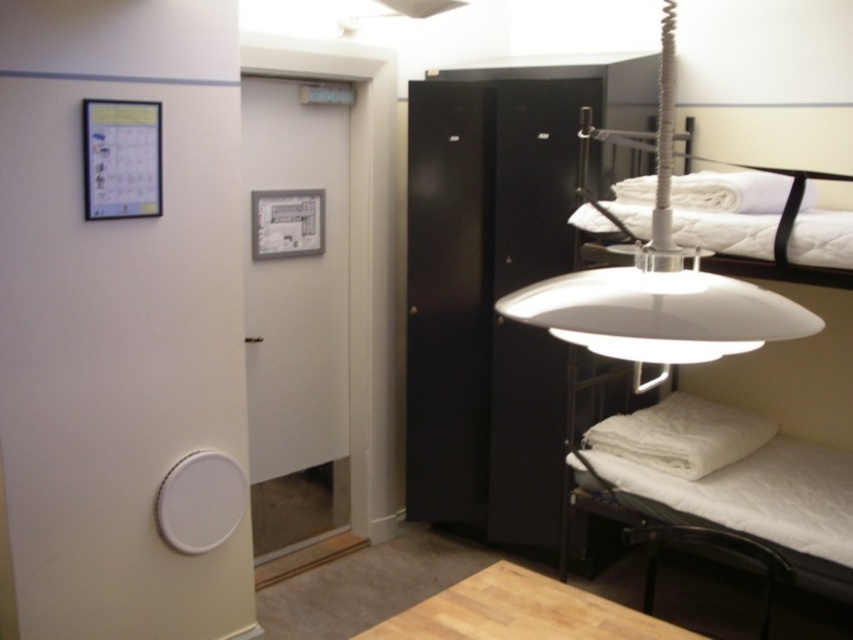
Question: Which is nearer to the white matte bed at lower right?

Choices:
 (A) white quilted bed at upper right
 (B) white matte lampshade at upper right

Answer: (A)

Question: Can you confirm if white matte bed at lower right is positioned above white matte lampshade at upper right?

Choices:
 (A) no
 (B) yes

Answer: (A)

Question: Which point is closer to the camera taking this photo?

Choices:
 (A) (668, 369)
 (B) (729, 256)
 (C) (837, 568)

Answer: (A)

Question: Among these points, which one is nearest to the camera?

Choices:
 (A) (576, 305)
 (B) (759, 250)

Answer: (A)

Question: Is white matte bed at lower right above white matte lampshade at upper right?

Choices:
 (A) no
 (B) yes

Answer: (A)

Question: Is white matte lampshade at upper right thinner than white quilted bed at upper right?

Choices:
 (A) no
 (B) yes

Answer: (B)